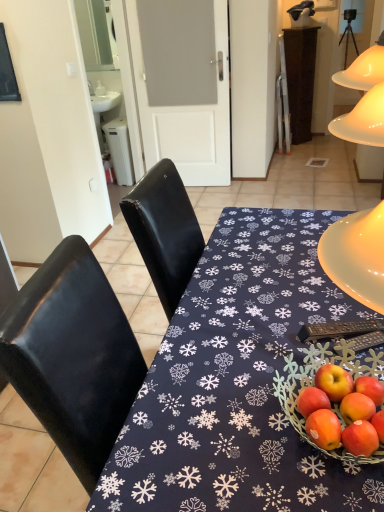
Question: Visually, is black plastic remote control at lower right positioned to the left or to the right of matte black table at center?

Choices:
 (A) left
 (B) right

Answer: (B)

Question: From a real-world perspective, is black plastic remote control at lower right above or below matte black table at center?

Choices:
 (A) below
 (B) above

Answer: (B)

Question: From the image's perspective, is black plastic remote control at lower right positioned above or below matte black table at center?

Choices:
 (A) below
 (B) above

Answer: (B)

Question: Looking at the image, does matte black table at center seem bigger or smaller compared to black plastic remote control at lower right?

Choices:
 (A) big
 (B) small

Answer: (A)

Question: From the image's perspective, relative to black plastic remote control at lower right, is matte black table at center above or below?

Choices:
 (A) below
 (B) above

Answer: (A)

Question: Considering their positions, is matte black table at center located in front of or behind black plastic remote control at lower right?

Choices:
 (A) front
 (B) behind

Answer: (A)

Question: Is matte black table at center spatially inside black plastic remote control at lower right, or outside of it?

Choices:
 (A) inside
 (B) outside

Answer: (B)